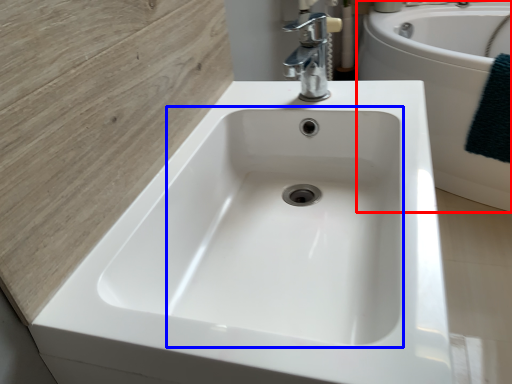
Question: Which of the following is the closest to the observer, bath (highlighted by a red box) or sink (highlighted by a blue box)?

Choices:
 (A) bath
 (B) sink

Answer: (B)